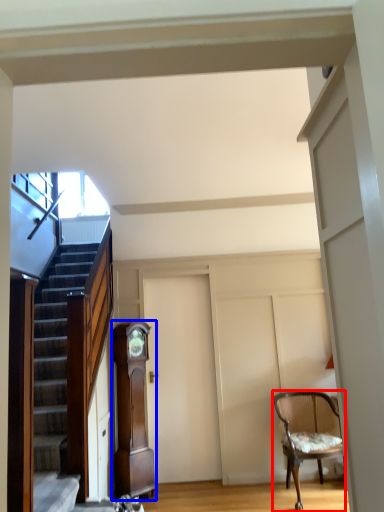
Question: Which object is closer to the camera taking this photo, chair (highlighted by a red box) or cabinetry (highlighted by a blue box)?

Choices:
 (A) chair
 (B) cabinetry

Answer: (A)